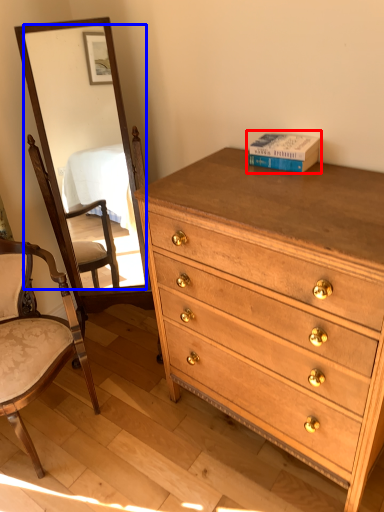
Question: Which point is closer to the camera, book (highlighted by a red box) or mirror (highlighted by a blue box)?

Choices:
 (A) book
 (B) mirror

Answer: (B)